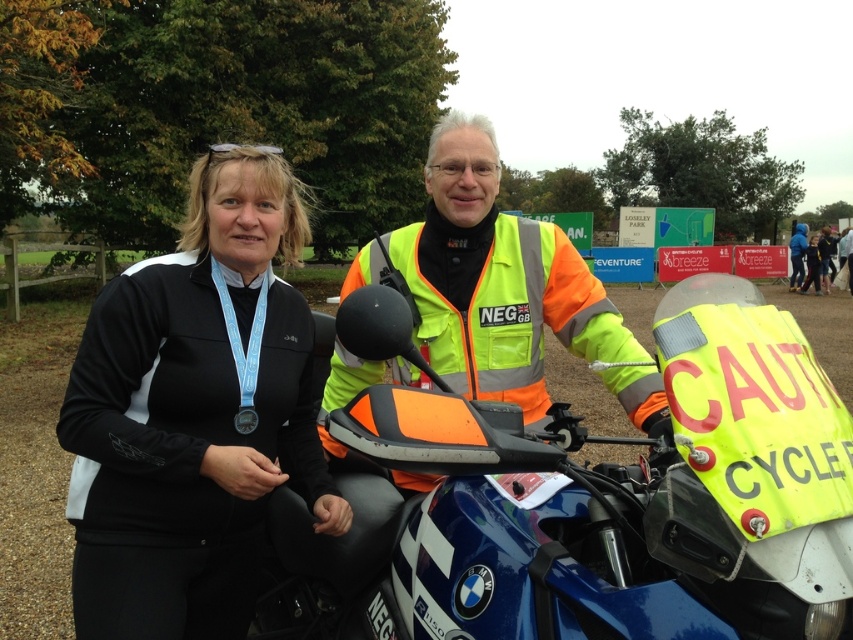
Can you confirm if metallic blue motorcycle at center is smaller than black fabric jacket at upper left?

Correct, metallic blue motorcycle at center occupies less space than black fabric jacket at upper left.

Does metallic blue motorcycle at center have a lesser height compared to black fabric jacket at upper left?

Correct, metallic blue motorcycle at center is not as tall as black fabric jacket at upper left.

The height and width of the screenshot is (640, 853). Find the location of `metallic blue motorcycle at center`. metallic blue motorcycle at center is located at coordinates (590, 504).

I want to click on metallic blue motorcycle at center, so click(590, 504).

Based on the photo, is black matte jacket at center shorter than neon yellow reflective jacket at center?

Incorrect, black matte jacket at center's height does not fall short of neon yellow reflective jacket at center's.

Can you confirm if black matte jacket at center is taller than neon yellow reflective jacket at center?

Correct, black matte jacket at center is much taller as neon yellow reflective jacket at center.

What are the coordinates of `black matte jacket at center` in the screenshot? It's located at (194, 413).

Between yellow reflective jacket at center and silver metallic medal at center, which one is positioned lower?

silver metallic medal at center

From the picture: Does yellow reflective jacket at center have a lesser height compared to silver metallic medal at center?

No.

The image size is (853, 640). What do you see at coordinates (817, 259) in the screenshot? I see `yellow reflective jacket at center` at bounding box center [817, 259].

I want to click on yellow reflective jacket at center, so click(817, 259).